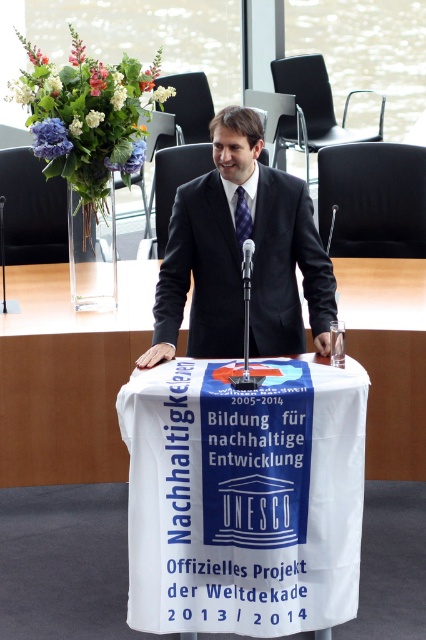
You are an attendee at this event and want to ask a question. You need to approach the podium. Which object should you move towards first, the black suit at center or the metallic silver microphone at center?

The black suit at center is to the left of the metallic silver microphone at center. Since you are approaching the podium, you should move towards the metallic silver microphone at center first as it is closer to the front of the podium where the speaker is positioned.

You are standing in the audience facing the podium. There are two points marked in the image. The first point is at coordinates point (x=207, y=349) and the second point is at point (x=333, y=218). Which point is closer to you?

Point (x=207, y=349) is in front of point (x=333, y=218), so it is closer to you.